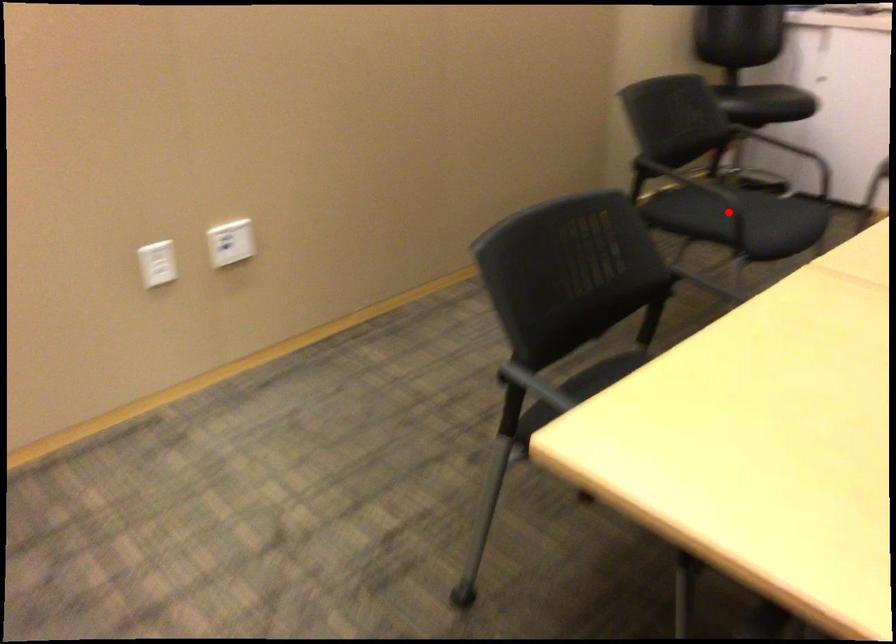
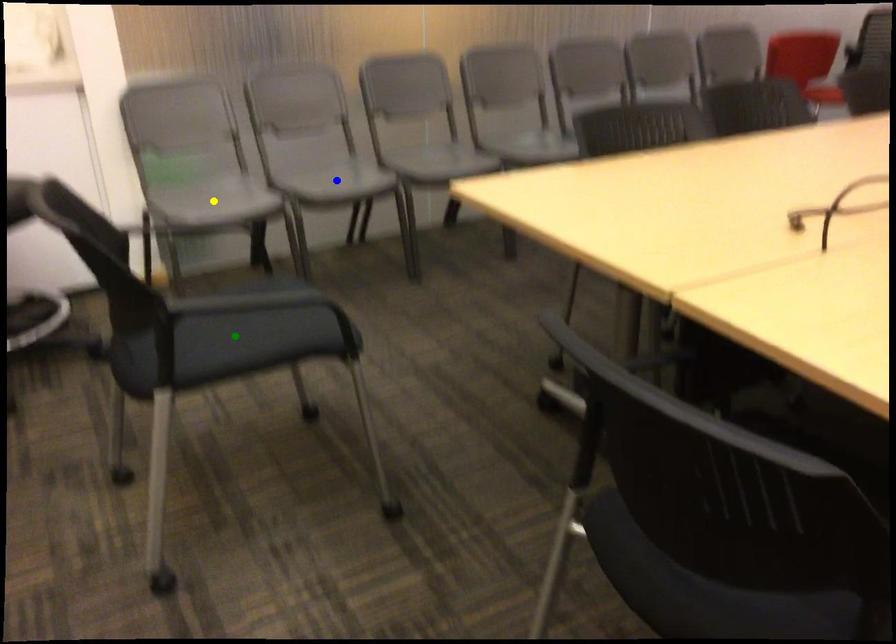
Question: I am providing you with two images of the same scene from different viewpoints. A red point is marked on the first image. You are given multiple points on the second image. Which mark in image 2 goes with the point in image 1?

Choices:
 (A) green point
 (B) blue point
 (C) yellow point

Answer: (A)